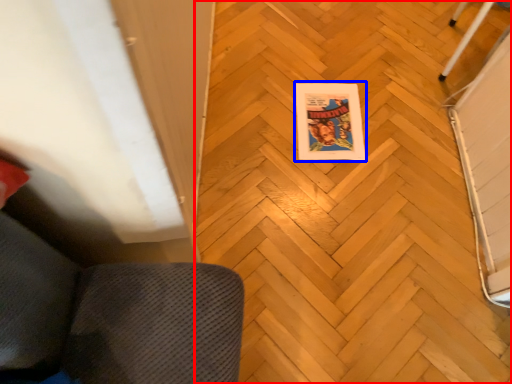
Question: Which of the following is the farthest to the observer, plywood (highlighted by a red box) or comic book (highlighted by a blue box)?

Choices:
 (A) plywood
 (B) comic book

Answer: (B)